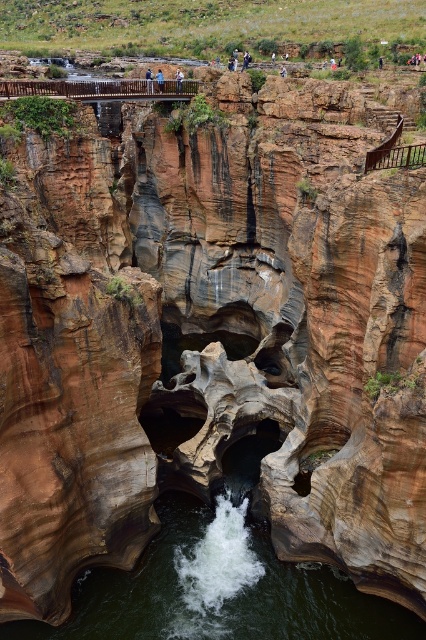
Question: Considering the relative positions of light blue shirt at upper center and light brown leather jacket at upper center in the image provided, where is light blue shirt at upper center located with respect to light brown leather jacket at upper center?

Choices:
 (A) above
 (B) below

Answer: (B)

Question: Which point appears closest to the camera in this image?

Choices:
 (A) (146, 77)
 (B) (158, 72)
 (C) (143, 602)
 (D) (244, 52)

Answer: (C)

Question: Among these points, which one is nearest to the camera?

Choices:
 (A) (245, 61)
 (B) (169, 547)
 (C) (161, 81)

Answer: (B)

Question: Does light blue jeans at center appear under light brown leather jacket at upper center?

Choices:
 (A) no
 (B) yes

Answer: (B)

Question: Can you confirm if brown smooth rock at center is bigger than blue denim jeans at upper center?

Choices:
 (A) no
 (B) yes

Answer: (A)

Question: Which object appears closest to the camera in this image?

Choices:
 (A) brown smooth rock at center
 (B) light blue jeans at center
 (C) blue denim jeans at upper center
 (D) light blue shirt at upper center

Answer: (A)